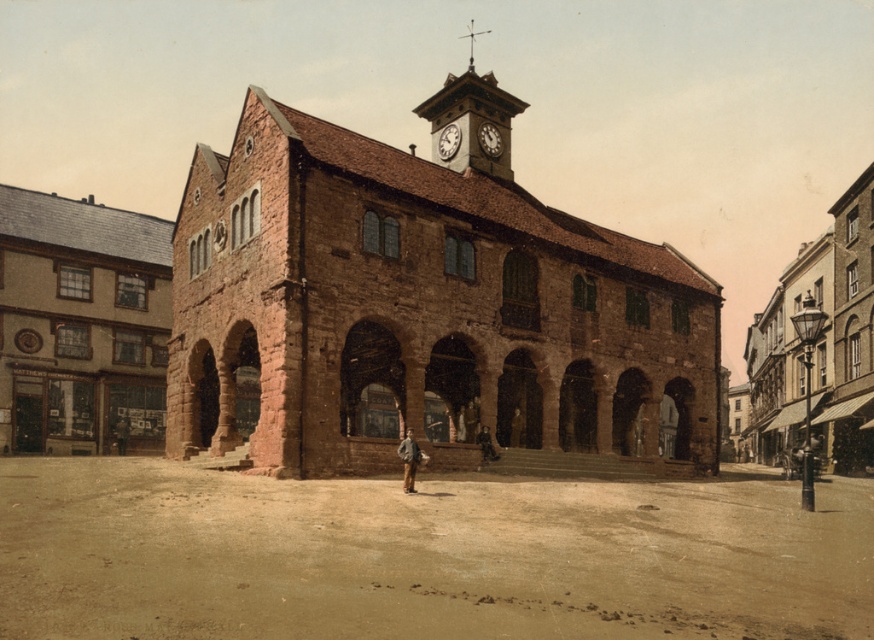
Question: From the image, what is the correct spatial relationship of white textured clock at upper center in relation to matte brown clock at upper center?

Choices:
 (A) left
 (B) right

Answer: (A)

Question: Which point is closer to the camera?

Choices:
 (A) (494, 138)
 (B) (442, 140)
 (C) (473, 125)

Answer: (C)

Question: Is white textured clock at upper center positioned behind matte brown clock at upper center?

Choices:
 (A) no
 (B) yes

Answer: (A)

Question: From the image, what is the correct spatial relationship of green stone clock tower at upper center in relation to white textured clock at upper center?

Choices:
 (A) right
 (B) left

Answer: (A)

Question: Which of the following is the farthest from the observer?

Choices:
 (A) (490, 125)
 (B) (494, 138)

Answer: (B)

Question: Which of the following is the closest to the observer?

Choices:
 (A) green stone clock tower at upper center
 (B) white textured clock at upper center
 (C) matte brown clock at upper center

Answer: (A)